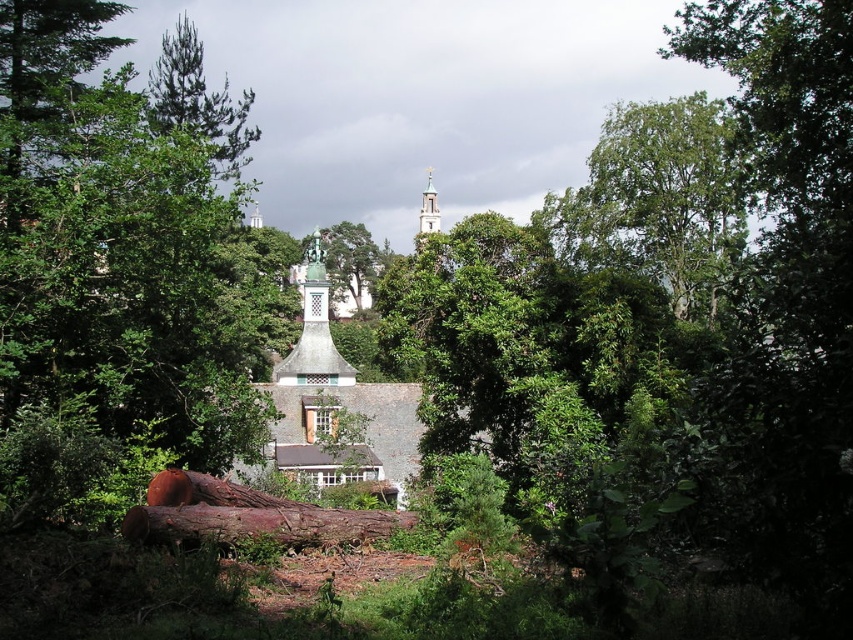
You are a gardener planning to place a new bench in the wooded area near the historic building. The bench requires a space wider than the brown rough wood log at lower center. Is there a suitable spot near the green leafy tree at lower left for placing the bench?

The green leafy tree at lower left is wider than the brown rough wood log at lower center. Since the bench requires a space wider than the brown rough wood log at lower center, the area near the green leafy tree at lower left may provide sufficient space for placing the bench.

You are standing in the wooded area looking at the historic building on the hill. There are two points marked in the image. Which point, point (227, 520) or point (432, 202), is closer to you?

Point (227, 520) is closer to the viewer than point (432, 202).